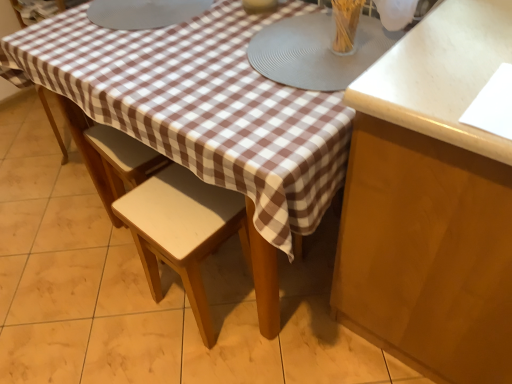
At what (x,y) coordinates should I click in order to perform the action: click on unoccupied area in front of light beige wood stool at center. Please return your answer as a coordinate pair (x, y). Looking at the image, I should click on (213, 359).